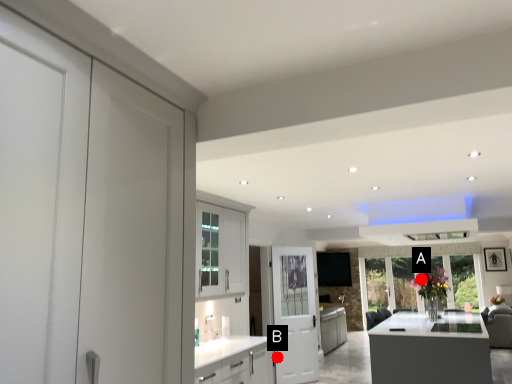
Question: Two points are circled on the image, labeled by A and B beside each circle. Which point is further to the camera?

Choices:
 (A) A is further
 (B) B is further

Answer: (A)